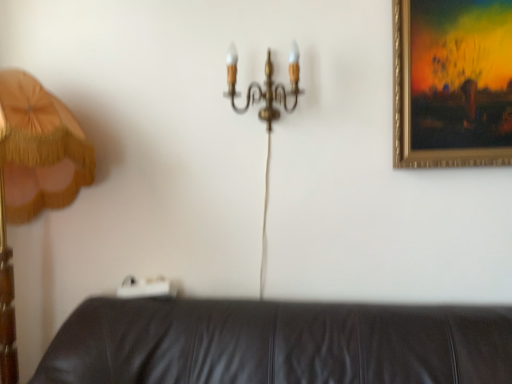
Question: From the image's perspective, is wooden lampshade at left located above or below gold metallic chandelier at upper center?

Choices:
 (A) above
 (B) below

Answer: (B)

Question: In terms of size, does wooden lampshade at left appear bigger or smaller than gold metallic chandelier at upper center?

Choices:
 (A) big
 (B) small

Answer: (A)

Question: Estimate the real-world distances between objects in this image. Which object is farther from the gold-framed painting at upper right?

Choices:
 (A) gold metallic chandelier at upper center
 (B) wooden lampshade at left

Answer: (B)

Question: Estimate the real-world distances between objects in this image. Which object is closer to the gold metallic chandelier at upper center?

Choices:
 (A) wooden lampshade at left
 (B) gold-framed painting at upper right

Answer: (B)